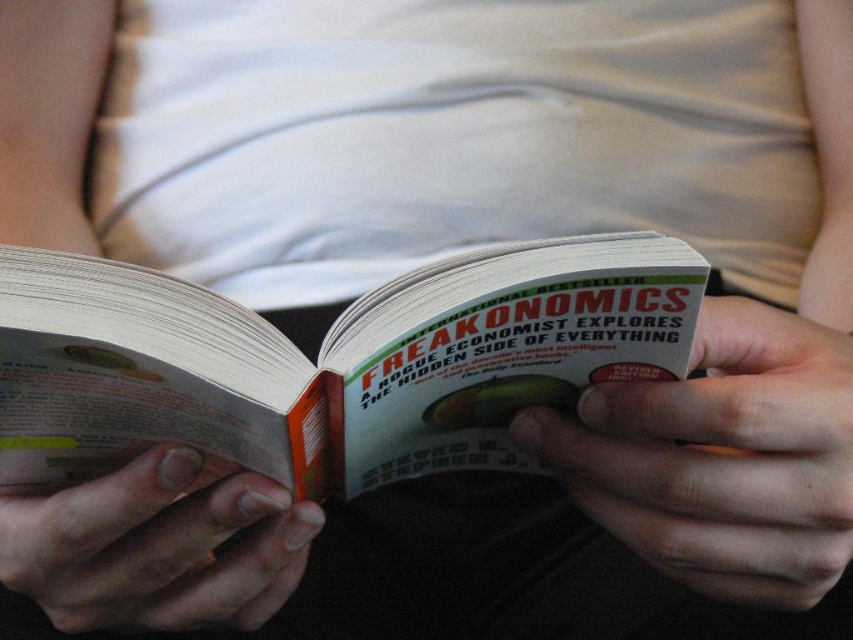
Looking at this image, you are a painter who needs to place a 8 inch wide brush on the table between the smooth skin hand at center and the smooth skin hand at lower left. Can the brush fit between them without overlapping the hands?

The smooth skin hand at center and smooth skin hand at lower left are 7.97 inches apart. Since the brush is 8 inches wide, it cannot fit between them without overlapping the hands.

Looking at the scene, where exactly is the smooth skin hand at center located in terms of coordinates?

The smooth skin hand at center is located at coordinates point (723, 456).

You are a book designer who wants to ensure the book fits comfortably in the reader s hand. Based on the scene, does the white paper book at center fit within the size of the smooth skin hand at center?

The white paper book at center is not as tall as the smooth skin hand at center, so it should fit comfortably within the hand size.